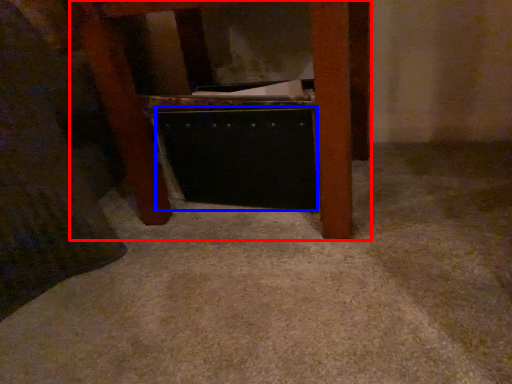
Question: Which object is further to the camera taking this photo, furniture (highlighted by a red box) or drawer (highlighted by a blue box)?

Choices:
 (A) furniture
 (B) drawer

Answer: (B)